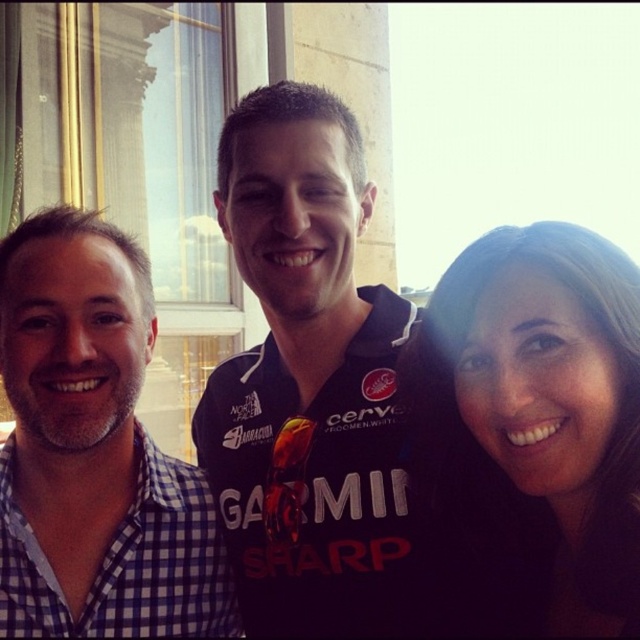
Question: Is brown hair at center smaller than blue jersey at center?

Choices:
 (A) yes
 (B) no

Answer: (A)

Question: Does brown hair at center come behind blue jersey at center?

Choices:
 (A) no
 (B) yes

Answer: (A)

Question: Which is nearer to the dark blue jersey at center?

Choices:
 (A) brown hair at center
 (B) blue jersey at center

Answer: (B)

Question: Is brown hair at center wider than blue jersey at center?

Choices:
 (A) yes
 (B) no

Answer: (B)

Question: Which of these objects is positioned closest to the blue jersey at center?

Choices:
 (A) dark blue jersey at center
 (B) brown hair at center

Answer: (A)

Question: Which of the following is the farthest from the observer?

Choices:
 (A) (276, 324)
 (B) (604, 314)

Answer: (A)